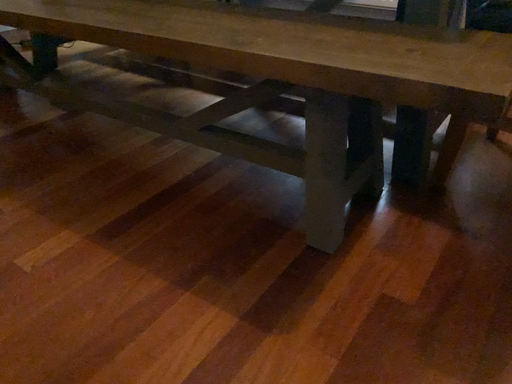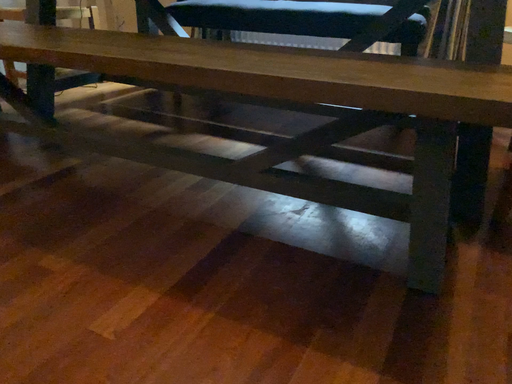
Question: How did the camera likely rotate when shooting the video?

Choices:
 (A) rotated left
 (B) rotated right

Answer: (B)